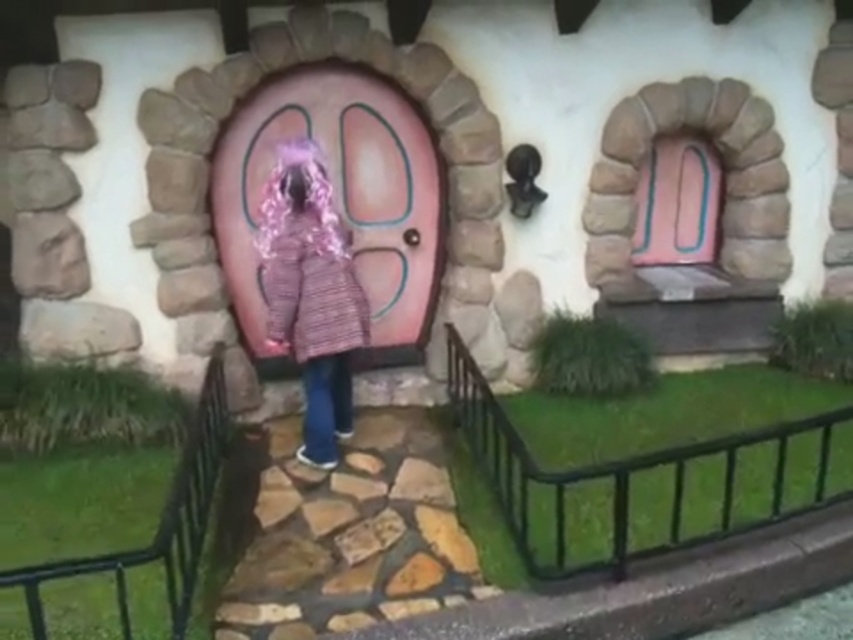
You are a visitor approaching the fairy tale house and see the pink knitted coat at center and the pink glossy door at upper center. Which object is closer to the ground?

The pink knitted coat at center is located below the pink glossy door at upper center, so it is closer to the ground.

You are a delivery person trying to deliver a package to the pink glossy door at upper center. You have a box that is 1.2 meters wide. Can you fit the box through the space where the pink knitted coat at center is currently standing?

The pink knitted coat at center is thinner than the pink glossy door at upper center, so the space where the coat is standing is narrower than the door. Since the box is 1.2 meters wide, it may not fit through the narrower space where the pink knitted coat at center is standing. Check the door width for better access.

You are a delivery person who needs to leave a package at the pink door of the fairy tale house. You are currently standing at the pink knitted coat at center. Which direction should you walk to reach the pink door?

Since the pink knitted coat at center is located at point (311, 292), you should walk towards the pink door which is positioned below the pink knitted coat at center in the image to reach it.